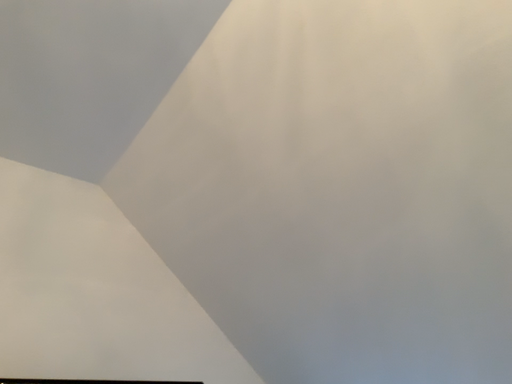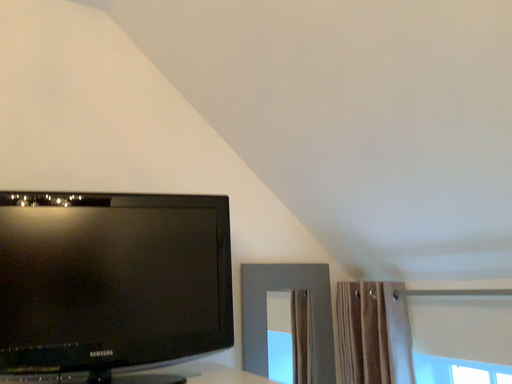
Question: How did the camera likely rotate when shooting the video?

Choices:
 (A) rotated downward
 (B) rotated upward

Answer: (A)